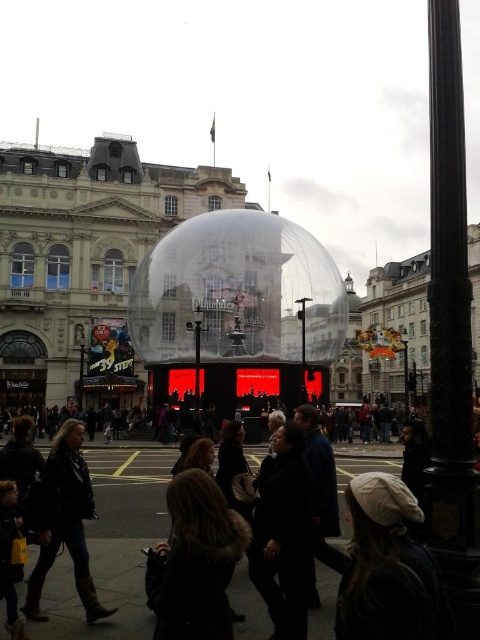
You are a photographer trying to capture a detailed shot of the white fabric hat at lower right and the dark brown fur coat at lower center. You want to ensure both items are in focus simultaneously. Given their sizes, which object should you prioritize placing closer to the camera to achieve this?

The white fabric hat at lower right is smaller in width than the dark brown fur coat at lower center. To ensure both are in focus, you should prioritize placing the smaller white fabric hat at lower right closer to the camera since smaller objects require less depth of field to be in focus compared to larger ones.

You are a photographer standing in the city square. You want to take a photo of the dome structure while ensuring both the white fabric hat at lower right and the dark brown leather jacket at lower left are visible in the frame. Which object should you adjust your focus on to ensure both are in the frame?

The white fabric hat at lower right has a smaller width than the dark brown leather jacket at lower left. To ensure both are in the frame, focus on the wider object, the dark brown leather jacket at lower left, as it requires more space. Adjust your camera angle to include both the dome and the wider jacket, ensuring the smaller hat remains visible.